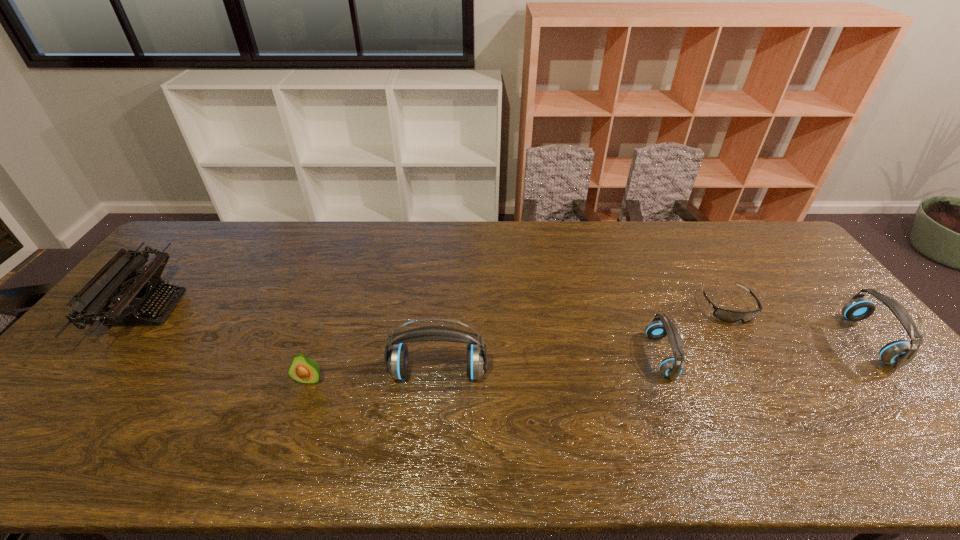
The headsets are evenly distributed in the image. To maintain this, where would you place another headset on the left? Please point to a free space. Please provide its 2D coordinates. Your answer should be formatted as a tuple, i.e. [(x, y)], where the tuple contains the x and y coordinates of a point satisfying the conditions above.

[(198, 392)]